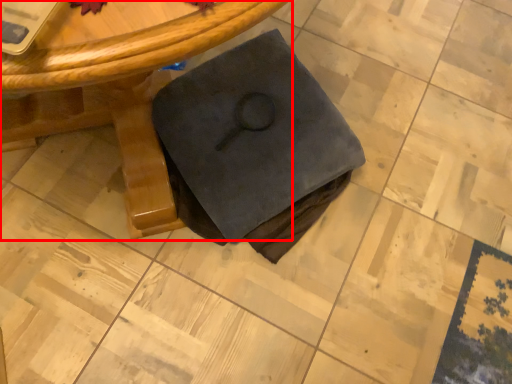
Question: From the image's perspective, where is table (annotated by the red box) located in relation to fabric in the image?

Choices:
 (A) below
 (B) above

Answer: (B)